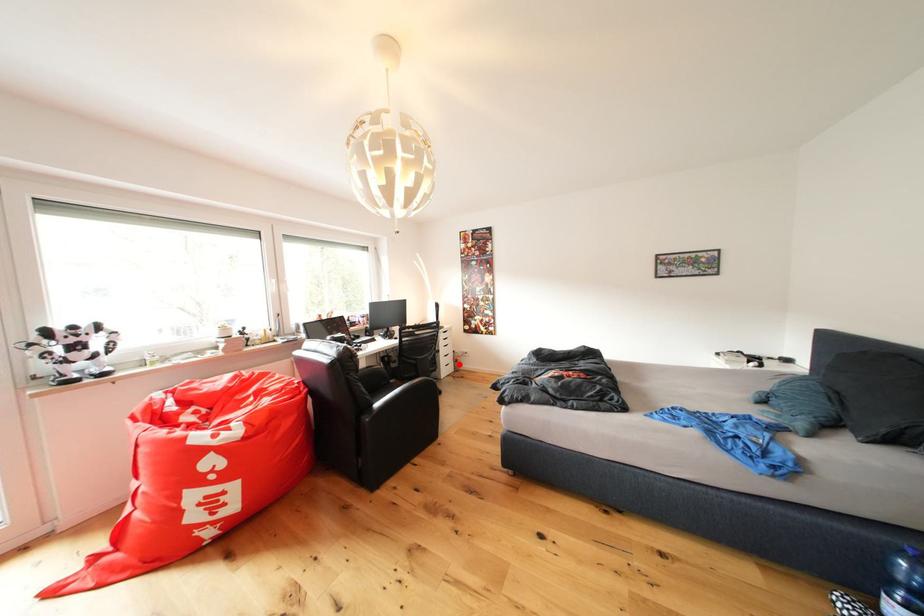
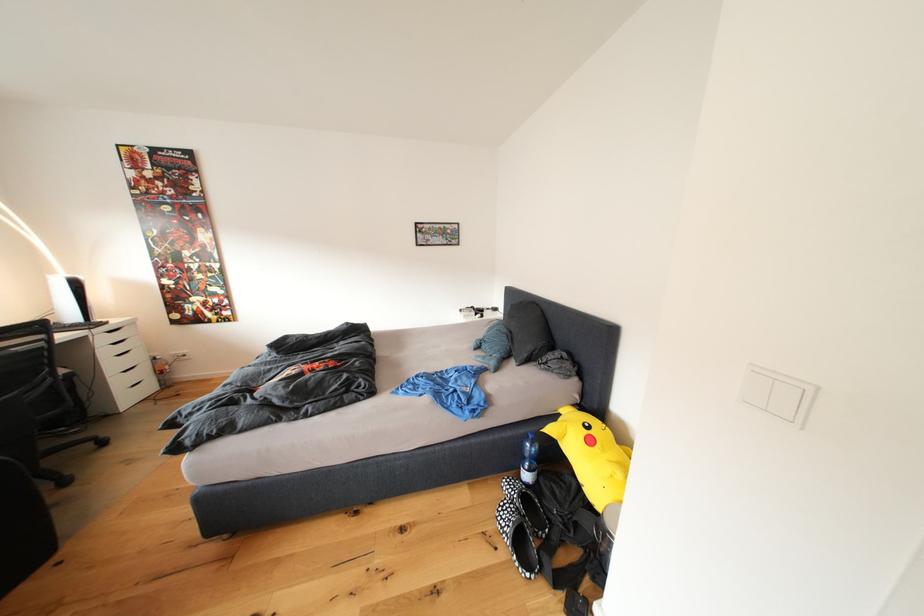
Question: I am providing you with two images of the same scene from different viewpoints. Image1 has a red point marked. In image2, the corresponding 3D location appears at what relative position? Reply with the corresponding letter.

Choices:
 (A) Closer
 (B) Farther

Answer: (A)